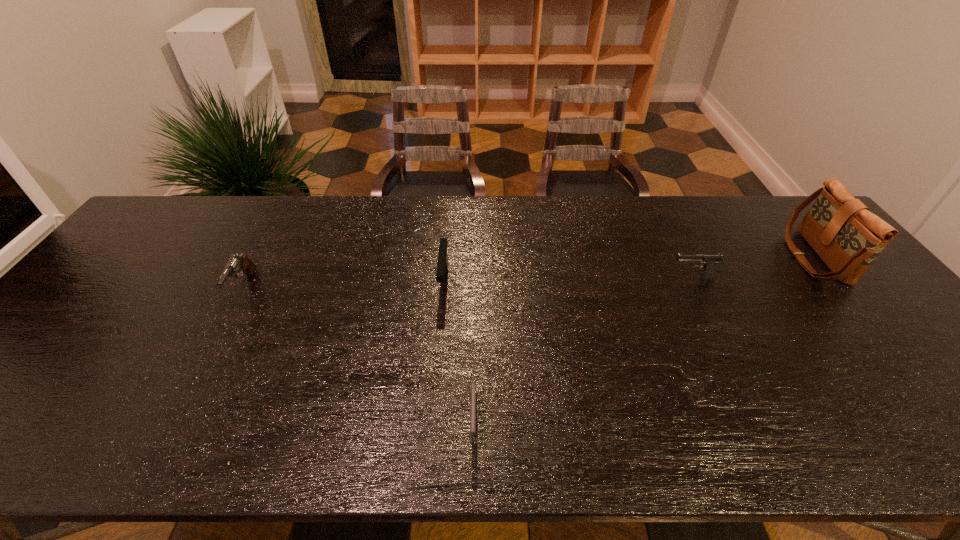
In the image, there is a desktop. At what (x,y) coordinates should I click in order to perform the action: click on free space at the near edge. Please return your answer as a coordinate pair (x, y). Looking at the image, I should click on (43, 432).

Identify the location of vacant space at the left edge of the desktop. 152,256.

This screenshot has width=960, height=540. Find the location of `free point at the far left corner`. free point at the far left corner is located at coordinates (199, 198).

In the image, there is a desktop. Where is `vacant space at the far right corner`? vacant space at the far right corner is located at coordinates (785, 224).

At what (x,y) coordinates should I click in order to perform the action: click on vacant point located between the rightmost pistol and the shoulder bag. Please return your answer as a coordinate pair (x, y). This screenshot has width=960, height=540. Looking at the image, I should click on (753, 267).

At what (x,y) coordinates should I click in order to perform the action: click on unoccupied area between the third object from right to left and the second object from left to right. Please return your answer as a coordinate pair (x, y). Looking at the image, I should click on (459, 352).

At what (x,y) coordinates should I click in order to perform the action: click on vacant space that is in between the rightmost object and the nearest pistol. Please return your answer as a coordinate pair (x, y). Looking at the image, I should click on (643, 340).

I want to click on vacant area between the shoulder bag and the shortest pistol, so click(x=643, y=340).

Where is `vacant space in between the third pistol from right to left and the shoulder bag`? The height and width of the screenshot is (540, 960). vacant space in between the third pistol from right to left and the shoulder bag is located at coordinates (629, 269).

This screenshot has width=960, height=540. Find the location of `empty location between the leftmost pistol and the rightmost pistol`. empty location between the leftmost pistol and the rightmost pistol is located at coordinates (468, 282).